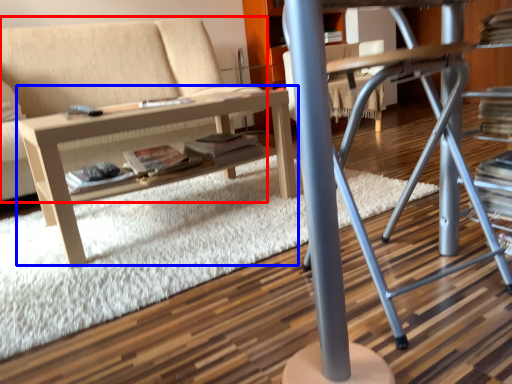
Question: Which point is further to the camera, studio couch (highlighted by a red box) or table (highlighted by a blue box)?

Choices:
 (A) studio couch
 (B) table

Answer: (A)